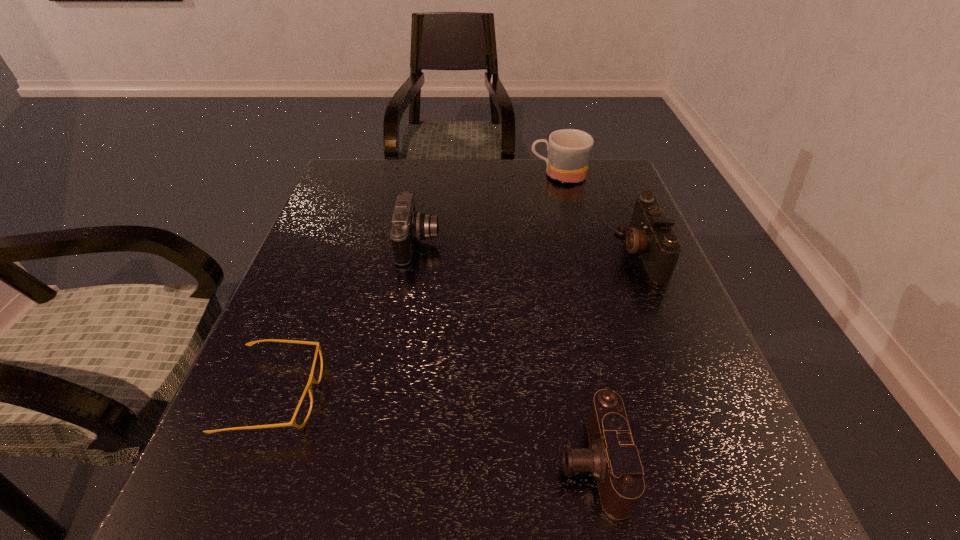
Find the location of `free space located on the front-facing side of the fourth object from right to left`. free space located on the front-facing side of the fourth object from right to left is located at coordinates (580, 244).

Find the location of a particular element. blank space located on the front-facing side of the rightmost object is located at coordinates (596, 253).

Find the location of `vacant space located 0.190m on the front-facing side of the rightmost object`. vacant space located 0.190m on the front-facing side of the rightmost object is located at coordinates (540, 253).

Locate an element on the screen. This screenshot has width=960, height=540. vacant space located on the front-facing side of the rightmost object is located at coordinates (558, 253).

The height and width of the screenshot is (540, 960). What are the coordinates of `free space located 0.280m on the front-facing side of the fourth tallest object` in the screenshot? It's located at (377, 462).

The height and width of the screenshot is (540, 960). Find the location of `vacant area situated 0.380m on the front-facing side of the fourth tallest object`. vacant area situated 0.380m on the front-facing side of the fourth tallest object is located at coordinates (311, 462).

This screenshot has width=960, height=540. Find the location of `vacant point located 0.190m on the front-facing side of the fourth tallest object`. vacant point located 0.190m on the front-facing side of the fourth tallest object is located at coordinates 436,462.

At what (x,y) coordinates should I click in order to perform the action: click on vacant space located 0.300m in front of the lenses of the spectacles. Please return your answer as a coordinate pair (x, y). This screenshot has height=540, width=960. Looking at the image, I should click on (493, 396).

Where is `object located in the far edge section of the desktop`? The height and width of the screenshot is (540, 960). object located in the far edge section of the desktop is located at coordinates (569, 150).

Where is `object located at the near edge`? This screenshot has height=540, width=960. object located at the near edge is located at coordinates (612, 458).